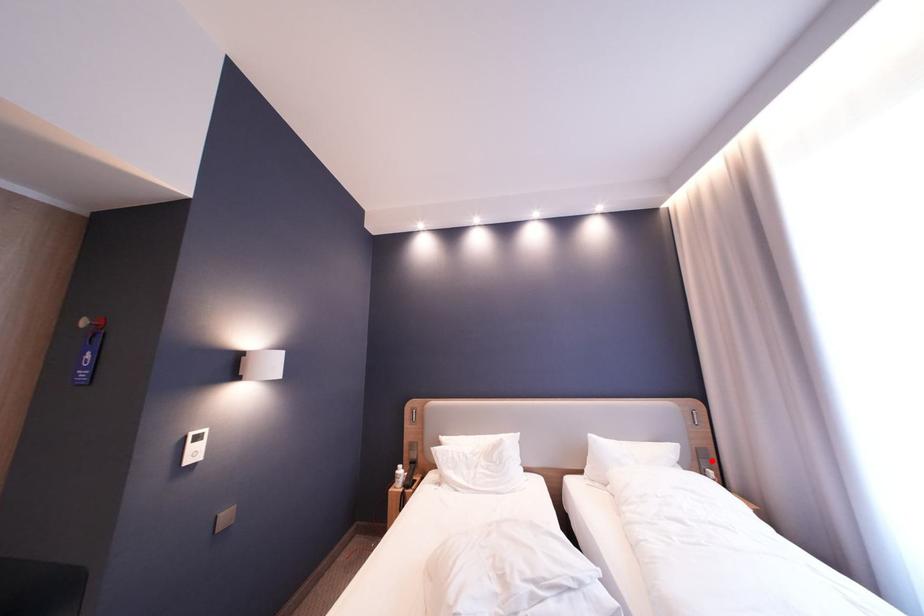
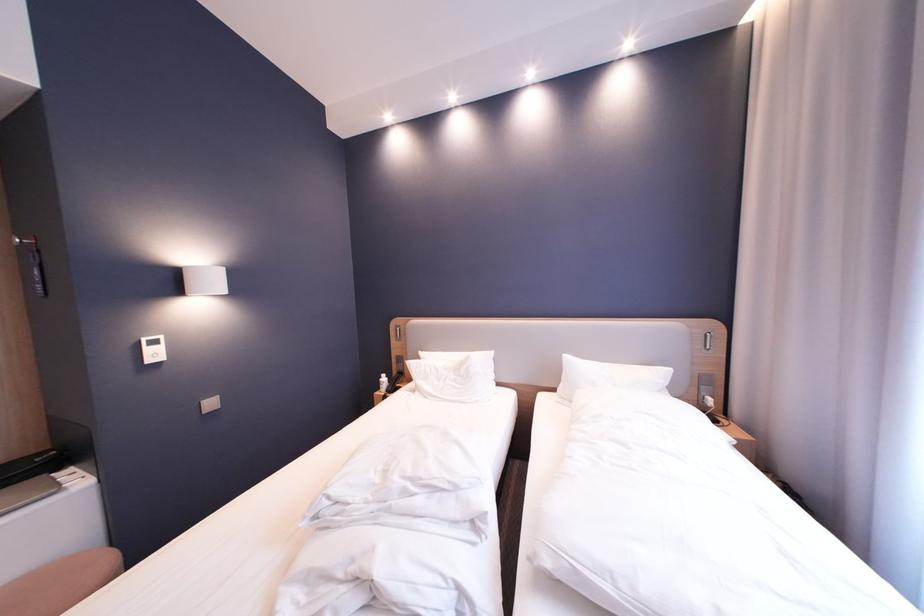
Locate, in the second image, the point that corresponds to the highlighted location in the first image.

(713, 387)